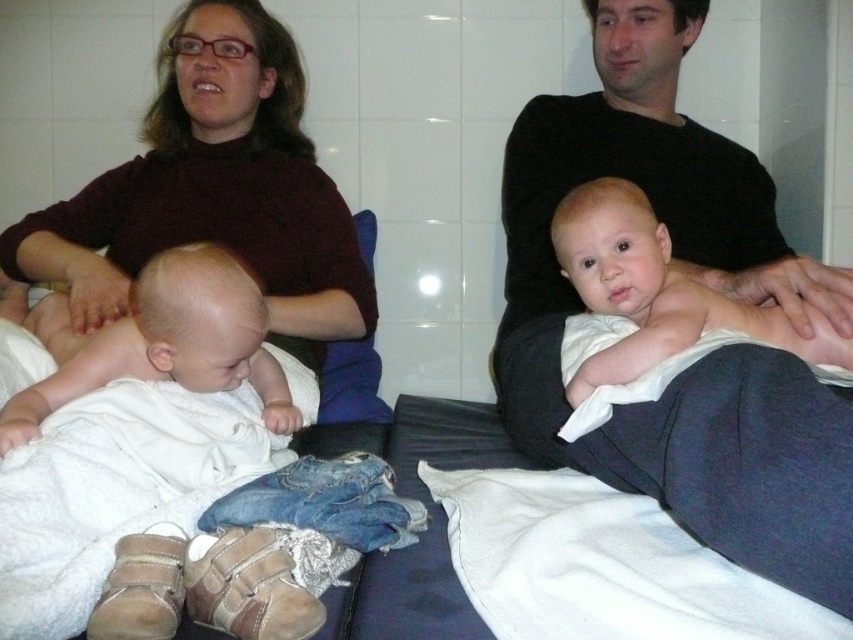
You are a photographer trying to capture a clear shot of the white clothed baby at upper right and the matte brown sweater at upper left. Which object is closer to the camera?

The matte brown sweater at upper left is closer to the camera because the white clothed baby at upper right is behind it.

You are a photographer trying to capture a closeup shot of the black cotton shirt at upper right and the white clothed baby at upper right. Since you want to focus on both subjects, which one should you zoom in on first to ensure they are both in frame?

The black cotton shirt at upper right is bigger than the white clothed baby at upper right, so you should zoom in on the black cotton shirt at upper right first to ensure both are in frame.

What is the exact 2D coordinate of the black cotton shirt at upper right in the image?

The black cotton shirt at upper right is located at the coordinate point of (x=699, y=280).